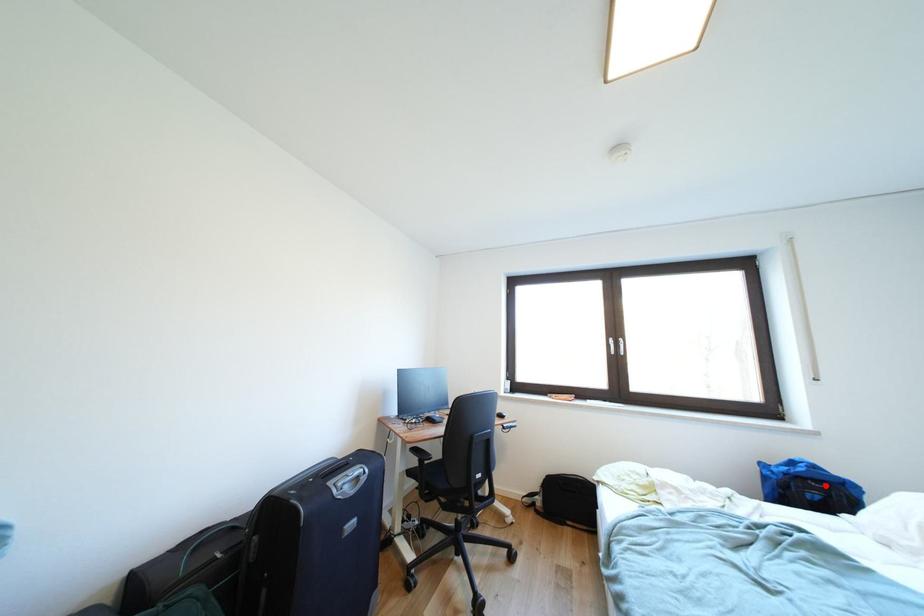
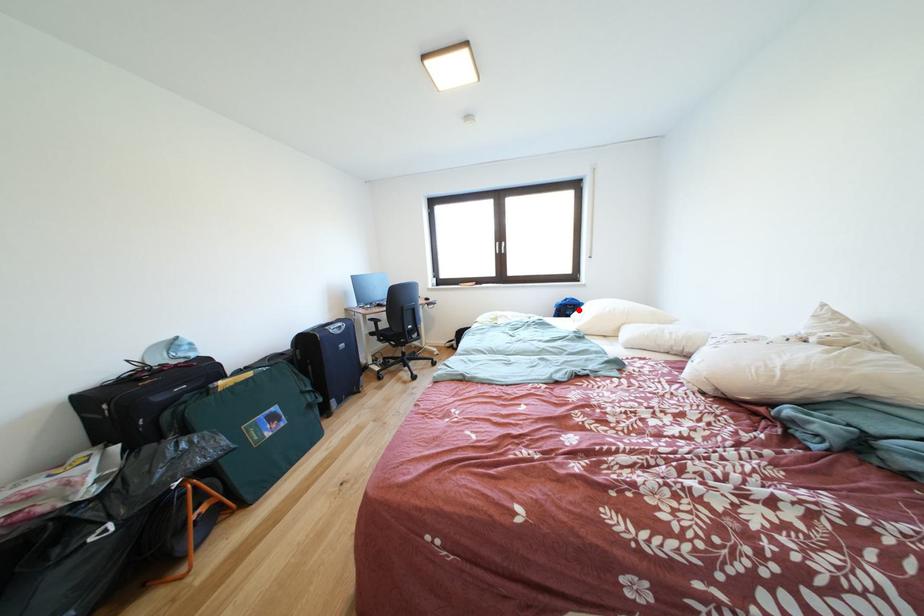
I am providing you with two images of the same scene from different viewpoints. A red point is marked on the first image and another point is marked on the second image. Are the points marked in image1 and image2 representing the same 3D position?

Yes